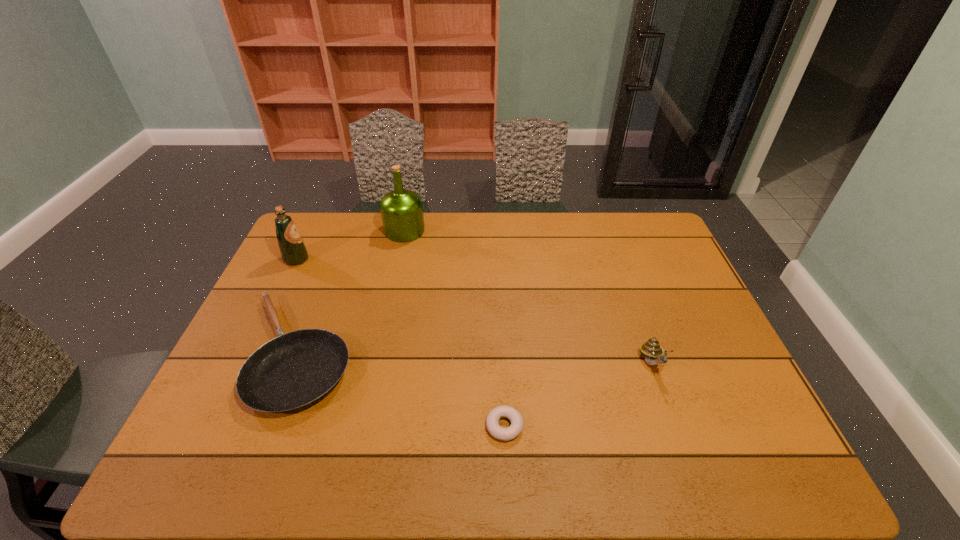
Locate an element on the screen. blank area located 0.310m on the front-facing side of the fourth nearest object is located at coordinates (401, 259).

Locate an element on the screen. This screenshot has height=540, width=960. blank space located on the face of the rightmost object is located at coordinates point(664,397).

This screenshot has width=960, height=540. I want to click on vacant space situated on the right of the second shortest object, so click(x=478, y=353).

Find the location of `free space located on the back of the doughnut`. free space located on the back of the doughnut is located at coordinates (500, 321).

The width and height of the screenshot is (960, 540). Identify the location of object positioned at the near edge. (504, 434).

Where is `olive oil that is at the left edge`? olive oil that is at the left edge is located at coordinates (293, 250).

Find the location of `frying pan positioned at the left edge`. frying pan positioned at the left edge is located at coordinates (293, 371).

Where is `object present at the far left corner`? object present at the far left corner is located at coordinates (293, 250).

You are a GUI agent. You are given a task and a screenshot of the screen. Output one action in this format:
    pyautogui.click(x=<x>, y=<y>)
    Task: Click on the free space at the far edge of the desktop
    The width and height of the screenshot is (960, 540).
    Given the screenshot: What is the action you would take?
    pyautogui.click(x=354, y=217)

In the image, there is a desktop. Identify the location of vacant space at the near edge. (294, 448).